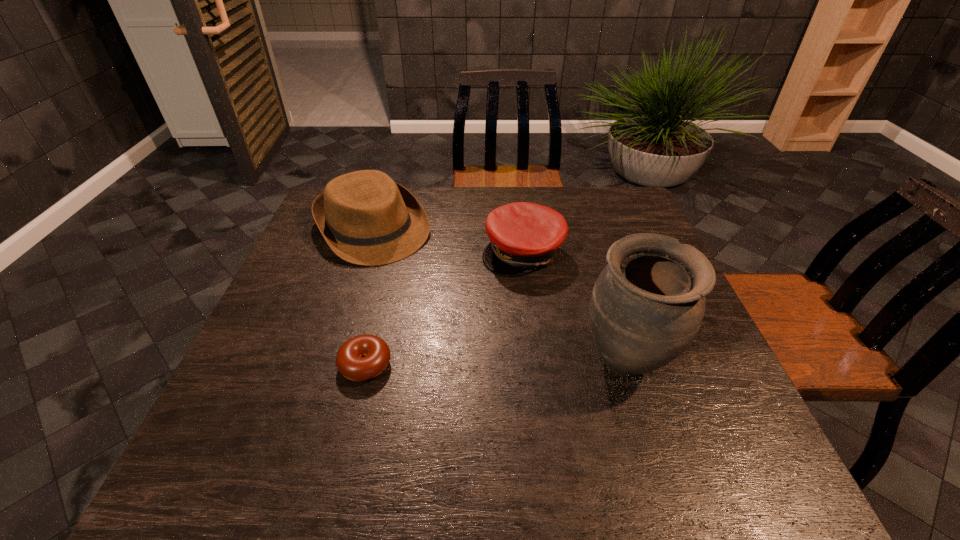
Locate an element on the screen. Image resolution: width=960 pixels, height=540 pixels. free space located 0.210m on the front-facing side of the second tallest object is located at coordinates (433, 306).

This screenshot has height=540, width=960. Identify the location of free space located 0.360m on the front-facing side of the second tallest object. (465, 346).

Find the location of a particular element. object that is at the far edge is located at coordinates (366, 218).

This screenshot has width=960, height=540. I want to click on object positioned at the near edge, so click(647, 305).

Locate an element on the screen. The width and height of the screenshot is (960, 540). object located at the left edge is located at coordinates (366, 218).

Locate an element on the screen. The image size is (960, 540). object at the right edge is located at coordinates click(647, 305).

In order to click on object situated at the far left corner in this screenshot , I will do `click(366, 218)`.

The image size is (960, 540). I want to click on object that is at the near right corner, so click(647, 305).

Find the location of a particular element. The image size is (960, 540). blank space at the far edge is located at coordinates (473, 193).

This screenshot has height=540, width=960. Identify the location of vacant space at the near edge of the desktop. (548, 396).